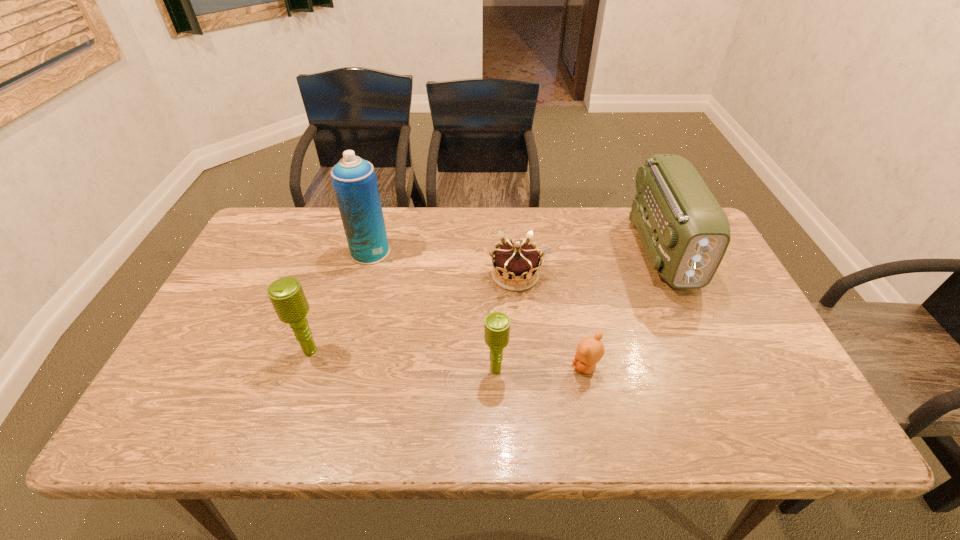
I want to click on vacant point located between the left microphone and the teddy bear, so click(448, 359).

Image resolution: width=960 pixels, height=540 pixels. I want to click on vacant area between the aerosol can and the taller microphone, so click(x=341, y=301).

Find the location of a particular element. Image resolution: width=960 pixels, height=540 pixels. empty location between the crown and the teddy bear is located at coordinates (550, 321).

The width and height of the screenshot is (960, 540). I want to click on empty space that is in between the radio_receiver and the second object from right to left, so click(624, 309).

Select which object appears as the third closest to the radio_receiver. Please provide its 2D coordinates. Your answer should be formatted as a tuple, i.e. [(x, y)], where the tuple contains the x and y coordinates of a point satisfying the conditions above.

[(497, 324)]

Identify which object is the third closest to the aerosol can. Please provide its 2D coordinates. Your answer should be formatted as a tuple, i.e. [(x, y)], where the tuple contains the x and y coordinates of a point satisfying the conditions above.

[(497, 324)]

What are the coordinates of `vacant area that satisfies the following two spatial constraints: 1. on the front-facing side of the rightmost object; 2. on the face of the teddy bear` in the screenshot? It's located at (716, 367).

Identify the location of free spot that satisfies the following two spatial constraints: 1. on the front-facing side of the radio_receiver; 2. on the face of the teddy bear. The image size is (960, 540). (716, 367).

You are a GUI agent. You are given a task and a screenshot of the screen. Output one action in this format:
    pyautogui.click(x=<x>, y=<y>)
    Task: Click on the free spot that satisfies the following two spatial constraints: 1. on the back side of the left microphone; 2. on the left side of the crown
    This screenshot has width=960, height=540.
    Given the screenshot: What is the action you would take?
    pyautogui.click(x=336, y=275)

This screenshot has width=960, height=540. What are the coordinates of `free space that satisfies the following two spatial constraints: 1. on the front-facing side of the radio_receiver; 2. on the face of the second object from right to left` in the screenshot? It's located at (716, 367).